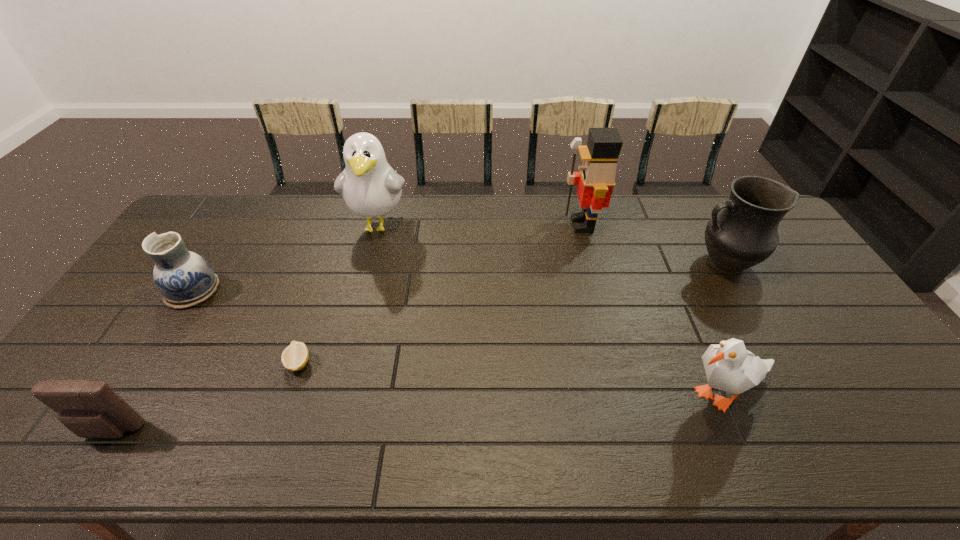
Locate an element on the screen. the taller gull is located at coordinates (371, 188).

Identify the location of the farther gull. (371, 188).

Identify the location of nutcracker. (596, 179).

At what (x,y) coordinates should I click in order to perform the action: click on pitcher. Please return your answer as a coordinate pair (x, y). This screenshot has height=540, width=960. Looking at the image, I should click on (744, 234).

You are a GUI agent. You are given a task and a screenshot of the screen. Output one action in this format:
    pyautogui.click(x=<x>, y=<y>)
    Task: Click on the right gull
    The image size is (960, 540).
    Given the screenshot: What is the action you would take?
    pyautogui.click(x=730, y=367)

At what (x,y) coordinates should I click in order to perform the action: click on the nearer gull. Please return your answer as a coordinate pair (x, y). This screenshot has height=540, width=960. Looking at the image, I should click on (730, 367).

At what (x,y) coordinates should I click in order to perform the action: click on pottery. Please return your answer as a coordinate pair (x, y). Looking at the image, I should click on tap(185, 279).

Locate an element on the screen. The width and height of the screenshot is (960, 540). the sixth tallest object is located at coordinates (90, 409).

The image size is (960, 540). What are the coordinates of `lemon` in the screenshot? It's located at (295, 356).

Locate an element on the screen. The height and width of the screenshot is (540, 960). vacant region located on the beak of the left gull is located at coordinates (359, 302).